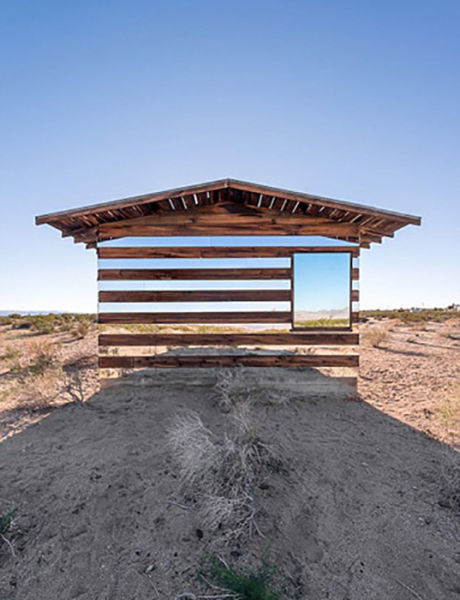
Locate an element on the screen. The width and height of the screenshot is (460, 600). top slat is located at coordinates (222, 248).